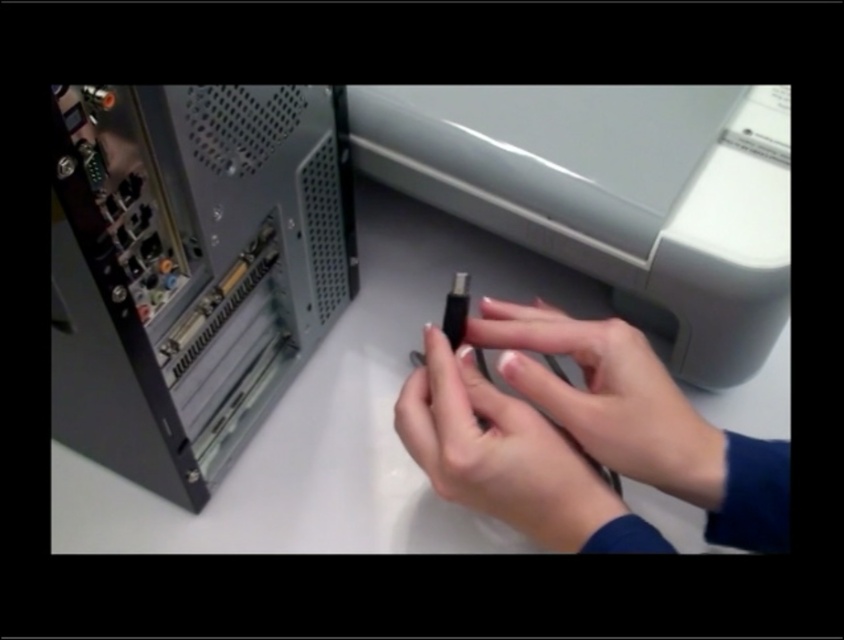
Question: Can you confirm if matte gray printer at center is positioned below smooth matte black usb drive at center?

Choices:
 (A) yes
 (B) no

Answer: (B)

Question: Does matte gray printer at center have a lesser width compared to smooth skin hands at center?

Choices:
 (A) no
 (B) yes

Answer: (A)

Question: Which is nearer to the smooth matte black usb drive at center?

Choices:
 (A) smooth skin hands at center
 (B) matte gray printer at center

Answer: (A)

Question: Which object appears closest to the camera in this image?

Choices:
 (A) black plastic computer at center
 (B) smooth skin hands at center
 (C) smooth matte black usb drive at center

Answer: (A)

Question: Which of the following is the farthest from the observer?

Choices:
 (A) (540, 381)
 (B) (583, 538)
 (C) (274, 284)
 (D) (528, 116)

Answer: (C)

Question: Is black plastic computer at center bigger than smooth skin hands at center?

Choices:
 (A) no
 (B) yes

Answer: (B)